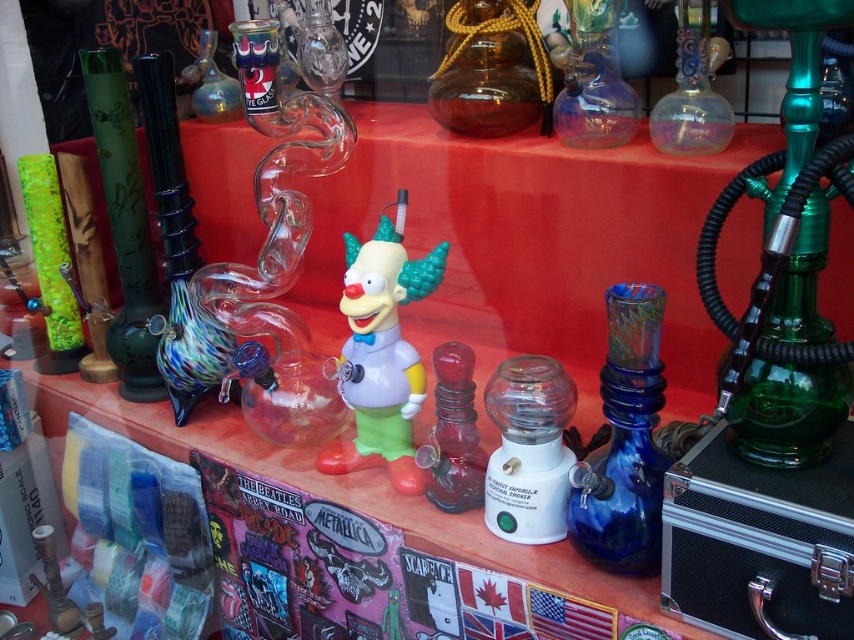
You are standing in front of the table with the vibrant glass items. There is a point marked at coordinates (x=788, y=412). Which object does this point belong to?

The point at coordinates (x=788, y=412) is located on the green glass hookah at right.

You are a customer at a glassware store and want to buy the green glass hookah at right and the translucent glass bong at center. You need to know which one is placed higher on the table. Can you tell me which one is higher?

The green glass hookah at right is located above the translucent glass bong at center, so the green glass hookah at right is placed higher on the table.